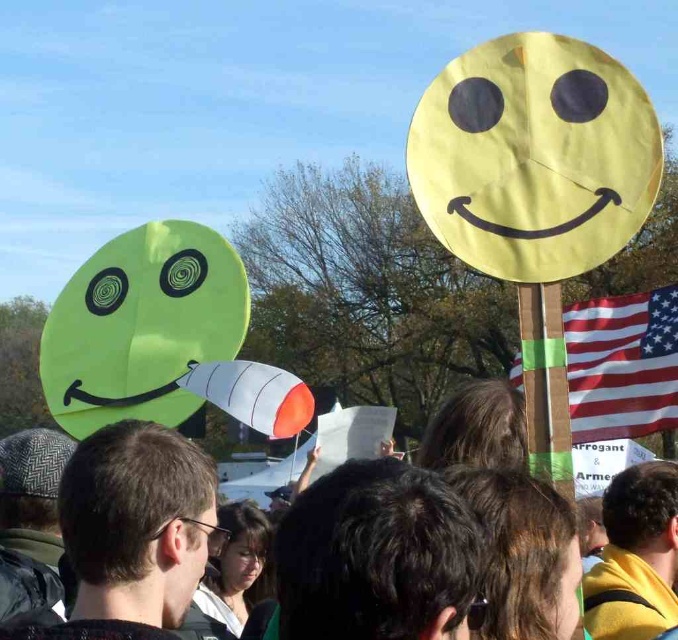
Is point (424, 536) farther from camera compared to point (296, 483)?

That is False.

Is point (466, 602) positioned behind point (66, 440)?

No, it is in front of (66, 440).

The image size is (678, 640). In order to click on dark brown hair at center in this screenshot , I will do `click(374, 554)`.

Does american flag at right have a greater width compared to smooth skin face at center?

Correct, the width of american flag at right exceeds that of smooth skin face at center.

Is american flag at right bigger than smooth skin face at center?

Correct, american flag at right is larger in size than smooth skin face at center.

The height and width of the screenshot is (640, 678). I want to click on american flag at right, so click(x=620, y=364).

The height and width of the screenshot is (640, 678). In order to click on american flag at right in this screenshot , I will do (x=620, y=364).

Locate an element on the screen. yellow fabric head at upper center is located at coordinates (635, 556).

Which is in front, point (643, 596) or point (226, 566)?

Positioned in front is point (643, 596).

Does point (671, 468) come behind point (226, 552)?

No, (671, 468) is in front of (226, 552).

You are a GUI agent. You are given a task and a screenshot of the screen. Output one action in this format:
    pyautogui.click(x=<x>, y=<y>)
    Task: Click on the yellow fabric head at upper center
    
    Given the screenshot: What is the action you would take?
    pyautogui.click(x=635, y=556)